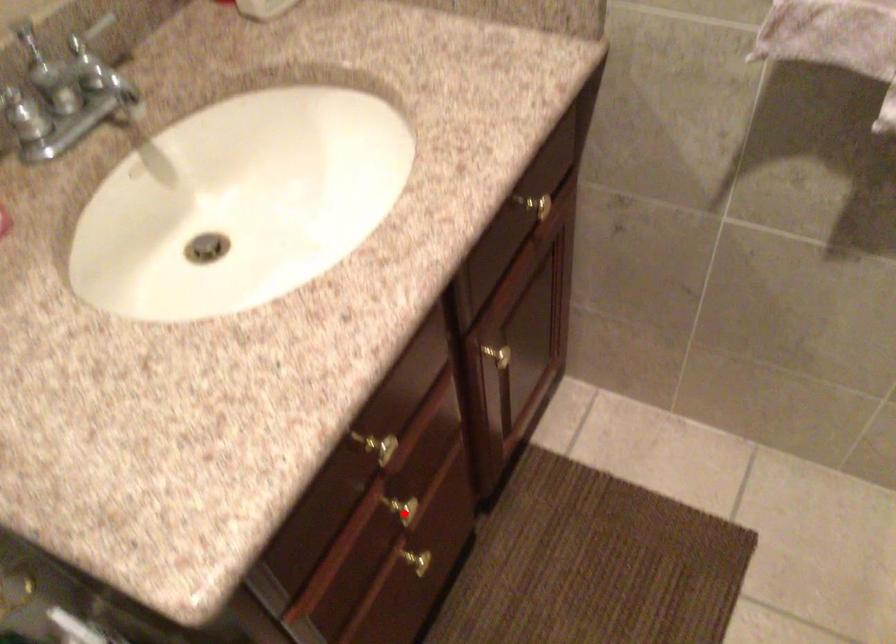
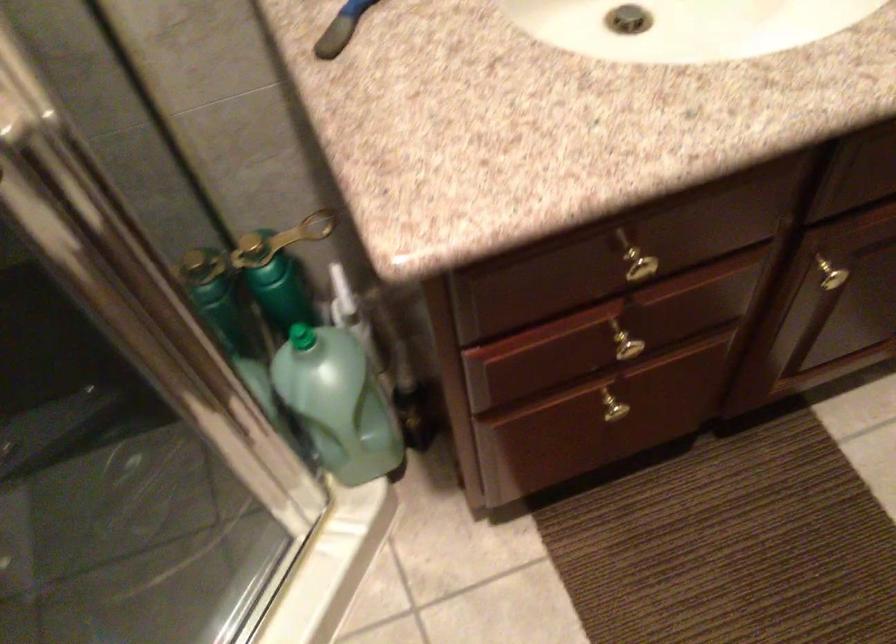
In the second image, find the point that corresponds to the highlighted location in the first image.

(625, 346)